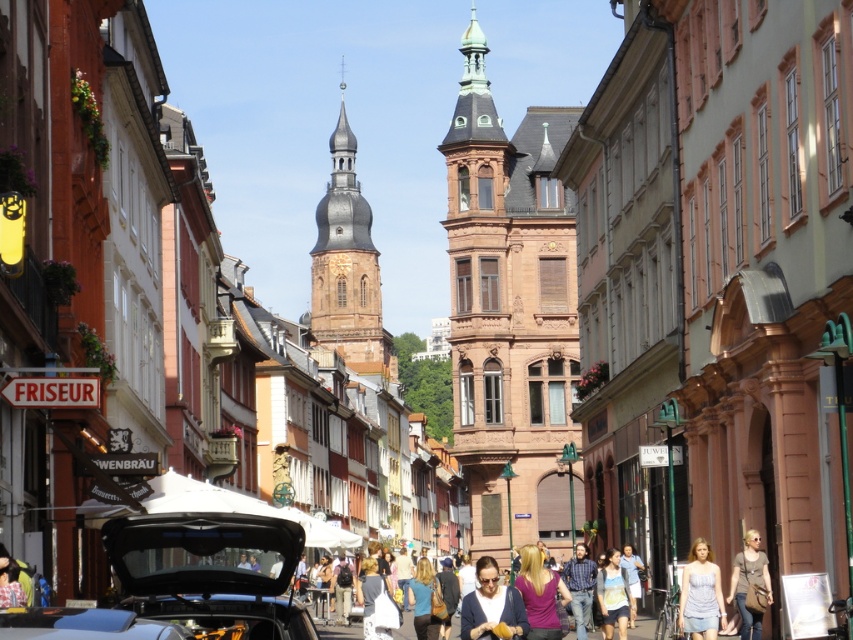
Which is in front, point (256, 554) or point (753, 582)?

Positioned in front is point (256, 554).

Does shiny blue car at center have a lesser height compared to light brown leather jacket at lower right?

Indeed, shiny blue car at center has a lesser height compared to light brown leather jacket at lower right.

Which is in front, point (219, 636) or point (735, 568)?

Point (219, 636)

Where is `shiny blue car at center`? The height and width of the screenshot is (640, 853). shiny blue car at center is located at coordinates (210, 572).

Is shiny black car at lower left thinner than blue plaid shirt at center?

Yes, shiny black car at lower left is thinner than blue plaid shirt at center.

Looking at this image, which of these two, shiny black car at lower left or blue plaid shirt at center, stands taller?

Standing taller between the two is blue plaid shirt at center.

Which is in front, point (68, 637) or point (587, 593)?

Point (68, 637)

I want to click on shiny black car at lower left, so click(84, 625).

Can you confirm if brown stone tower at center is positioned below brown stone bell tower at center?

Correct, brown stone tower at center is located below brown stone bell tower at center.

Does brown stone tower at center appear on the left side of brown stone bell tower at center?

Incorrect, brown stone tower at center is not on the left side of brown stone bell tower at center.

This screenshot has height=640, width=853. In order to click on brown stone tower at center in this screenshot , I will do `click(511, 316)`.